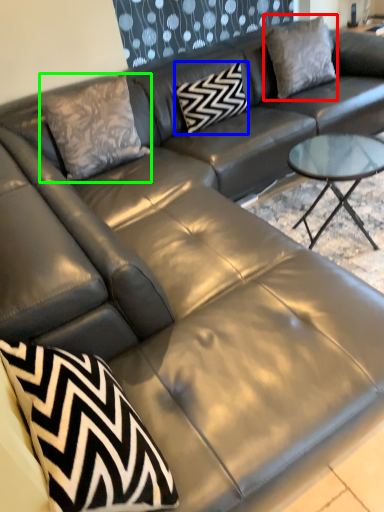
Question: Based on their relative distances, which object is farther from pillow (highlighted by a red box)? Choose from pillow (highlighted by a blue box) and throw pillow (highlighted by a green box).

Choices:
 (A) pillow
 (B) throw pillow

Answer: (B)